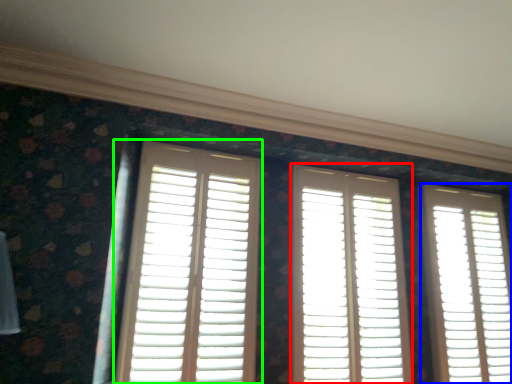
Question: Based on their relative distances, which object is nearer to window (highlighted by a red box)? Choose from window (highlighted by a blue box) and window (highlighted by a green box).

Choices:
 (A) window
 (B) window

Answer: (A)